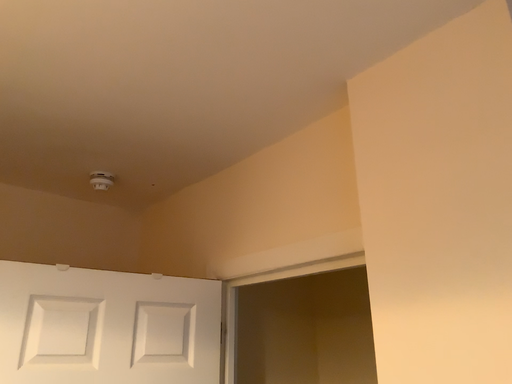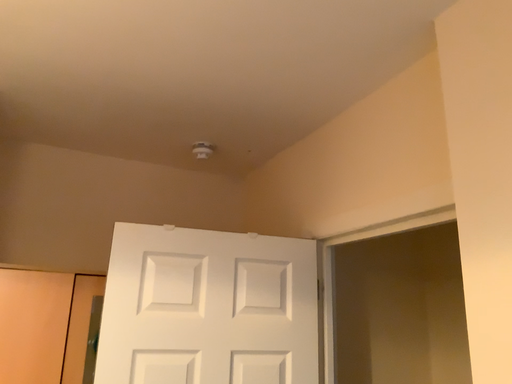
Question: Which way did the camera rotate in the video?

Choices:
 (A) rotated right
 (B) rotated left

Answer: (B)